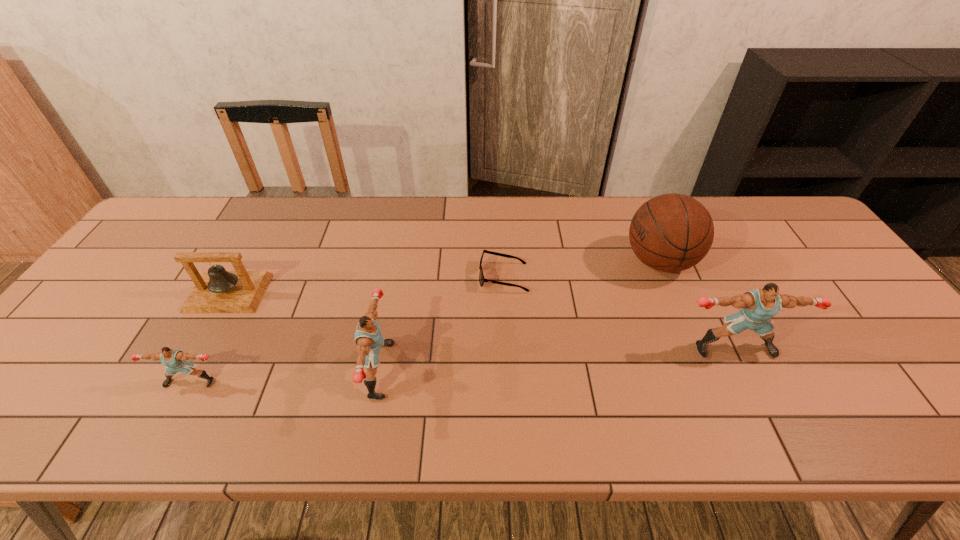
Identify the location of the shortest puncher. The image size is (960, 540). (175, 360).

Find the location of a particular element. the second puncher from right to left is located at coordinates (368, 337).

Where is `the second shortest puncher`? the second shortest puncher is located at coordinates (368, 337).

The height and width of the screenshot is (540, 960). I want to click on the rightmost puncher, so click(x=759, y=305).

This screenshot has width=960, height=540. In order to click on the third object from right to left in this screenshot , I will do `click(481, 276)`.

Find the location of a particular element. The width and height of the screenshot is (960, 540). the shortest object is located at coordinates (481, 276).

Locate an element on the screen. basketball is located at coordinates (671, 232).

Where is `bell`? bell is located at coordinates (217, 291).

At what (x,y) coordinates should I click in order to perform the action: click on vacant space situated on the front-facing side of the second puncher from left to right. Please return your answer as a coordinate pair (x, y). Looking at the image, I should click on (495, 370).

This screenshot has height=540, width=960. I want to click on vacant space situated 0.090m on the front-facing side of the rightmost puncher, so pyautogui.click(x=756, y=394).